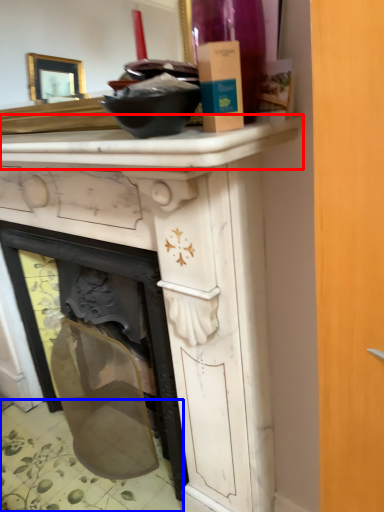
Question: Among these objects, which one is farthest to the camera, counter top (highlighted by a red box) or tile (highlighted by a blue box)?

Choices:
 (A) counter top
 (B) tile

Answer: (B)